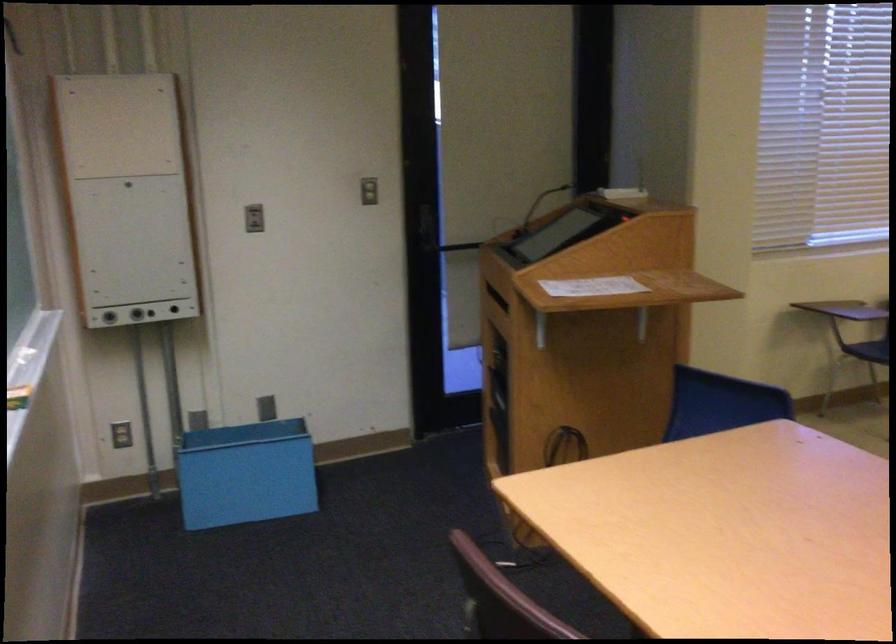
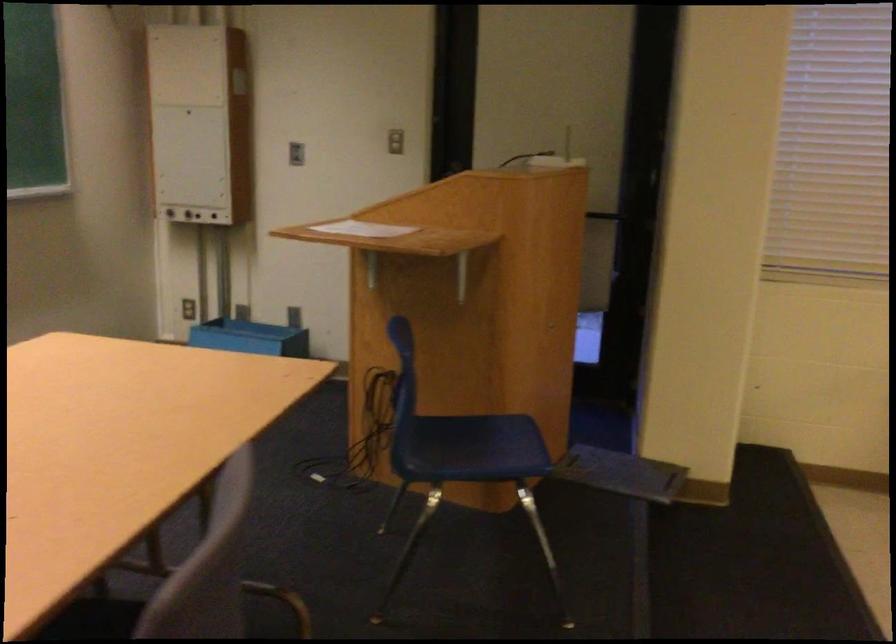
In the second image, find the point that corresponds to the point at 536,288 in the first image.

(362, 229)